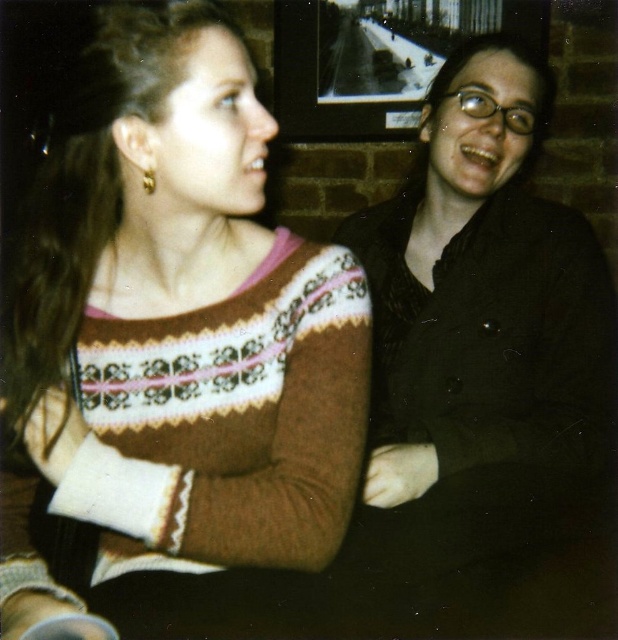
You are a photographer setting up for a portrait and need to focus on the matte black jacket at center and the gold metallic earring at upper left. Which object should you adjust your focus to first if you want to ensure both are in sharp focus?

The matte black jacket at center should be focused on first because it is closer to the viewer than the gold metallic earring at upper left. By focusing on the closer object, the depth of field may naturally include the earring in the background.

You are a photographer taking a closeup shot of the two people in the image. You need to focus on both the brown knitted sweater at upper left and the gold metallic earring at upper left. Which object should you adjust your camera focus to first if you want to ensure both are in focus, considering their sizes?

The brown knitted sweater at upper left is larger in size than the gold metallic earring at upper left. To ensure both are in focus, you should adjust your camera focus starting with the larger object, brown knitted sweater at upper left, as it requires more detailed focus due to its size.